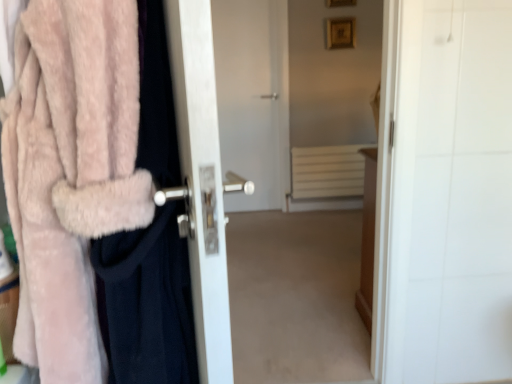
What is the approximate height of white matte radiator at center?

white matte radiator at center is 18.52 inches tall.

Locate an element on the screen. The image size is (512, 384). fuzzy pink coat at left is located at coordinates (147, 302).

Identify the location of white matte radiator at center. Image resolution: width=512 pixels, height=384 pixels. (328, 171).

Is fuzzy pink coat at left to the right of white matte radiator at center from the viewer's perspective?

No.

Are fuzzy pink coat at left and white matte radiator at center far apart?

Absolutely, fuzzy pink coat at left is distant from white matte radiator at center.

Is point (112, 133) farther from camera compared to point (345, 170)?

No, it is in front of (345, 170).

Looking at the image, does fuzzy pink coat at left seem bigger or smaller compared to white matte radiator at center?

Clearly, fuzzy pink coat at left is larger in size than white matte radiator at center.

Is fuzzy pink coat at left inside white glossy door handle at left?

No.

From the image's perspective, is white glossy door handle at left above fuzzy pink coat at left?

No, from the image's perspective, white glossy door handle at left is not above fuzzy pink coat at left.

Based on the photo, does white glossy door handle at left come behind fuzzy pink coat at left?

Yes, the depth of white glossy door handle at left is greater than that of fuzzy pink coat at left.

Which of these two, white matte radiator at center or fuzzy pink coat at left, is wider?

fuzzy pink coat at left.

Is white matte radiator at center positioned with its back to fuzzy pink coat at left?

white matte radiator at center is not turned away from fuzzy pink coat at left.

From the image's perspective, which one is positioned lower, white matte radiator at center or fuzzy pink coat at left?

fuzzy pink coat at left, from the image's perspective.

Could you tell me if white matte radiator at center is facing white glossy door handle at left?

Yes, white matte radiator at center faces towards white glossy door handle at left.

From the picture: Is white matte radiator at center directly adjacent to white glossy door handle at left?

There is a gap between white matte radiator at center and white glossy door handle at left.

At what (x,y) coordinates should I click in order to perform the action: click on radiator beneath the white glossy door handle at left (from a real-world perspective). Please return your answer as a coordinate pair (x, y). Looking at the image, I should click on coord(328,171).

Is point (325, 148) less distant than point (213, 267)?

No.

Based on the photo, looking at their sizes, would you say fuzzy pink coat at left is wider or thinner than fuzzy pink coat at left?

In the image, fuzzy pink coat at left appears to be wider than fuzzy pink coat at left.

Is fuzzy pink coat at left facing away from fuzzy pink coat at left?

Absolutely, fuzzy pink coat at left is directed away from fuzzy pink coat at left.

Does fuzzy pink coat at left appear on the left side of fuzzy pink coat at left?

Yes, fuzzy pink coat at left is to the left of fuzzy pink coat at left.

Based on the photo, is fuzzy pink coat at left not within fuzzy pink coat at left?

No, fuzzy pink coat at left is not outside of fuzzy pink coat at left.

From a real-world perspective, is white matte radiator at center beneath fuzzy pink coat at left?

Yes, from a real-world perspective, white matte radiator at center is beneath fuzzy pink coat at left.

Which is further, (318, 180) or (109, 44)?

Point (318, 180)

Is white matte radiator at center not close to fuzzy pink coat at left?

Yes, white matte radiator at center and fuzzy pink coat at left are quite far apart.

Is fuzzy pink coat at left wider or thinner than fuzzy pink coat at left?

fuzzy pink coat at left is thinner than fuzzy pink coat at left.

Between fuzzy pink coat at left and fuzzy pink coat at left, which one appears on the right side from the viewer's perspective?

Positioned to the right is fuzzy pink coat at left.

Is fuzzy pink coat at left oriented towards fuzzy pink coat at left?

Yes, fuzzy pink coat at left is turned towards fuzzy pink coat at left.

Between point (123, 324) and point (102, 187), which one is positioned in front?

The point (102, 187) is closer.

You are a GUI agent. You are given a task and a screenshot of the screen. Output one action in this format:
    pyautogui.click(x=<x>, y=<y>)
    Task: Click on the radiator below the fuzzy pink coat at left (from a real-world perspective)
    The width and height of the screenshot is (512, 384).
    Given the screenshot: What is the action you would take?
    pyautogui.click(x=328, y=171)

You are a GUI agent. You are given a task and a screenshot of the screen. Output one action in this format:
    pyautogui.click(x=<x>, y=<y>)
    Task: Click on the towel that appears in front of the white glossy door handle at left
    The width and height of the screenshot is (512, 384).
    Given the screenshot: What is the action you would take?
    pyautogui.click(x=70, y=172)

Considering their positions, is white matte radiator at center positioned further to fuzzy pink coat at left than white glossy door handle at left?

Based on the image, white matte radiator at center appears to be further to fuzzy pink coat at left.

When comparing their distances from fuzzy pink coat at left, does white glossy door handle at left or white matte radiator at center seem closer?

white glossy door handle at left.

Looking at the image, which one is located further to fuzzy pink coat at left, white matte radiator at center or fuzzy pink coat at left?

Among the two, white matte radiator at center is located further to fuzzy pink coat at left.

Looking at this image, based on their spatial positions, is white glossy door handle at left or fuzzy pink coat at left closer to white matte radiator at center?

fuzzy pink coat at left.

Based on their spatial positions, is fuzzy pink coat at left or white matte radiator at center further from fuzzy pink coat at left?

white matte radiator at center is further to fuzzy pink coat at left.

Looking at the image, which one is located further to white matte radiator at center, fuzzy pink coat at left or white glossy door handle at left?

white glossy door handle at left.

Which object lies nearer to the anchor point fuzzy pink coat at left, fuzzy pink coat at left or white matte radiator at center?

fuzzy pink coat at left is positioned closer to the anchor fuzzy pink coat at left.

From the picture: Looking at the image, which one is located further to fuzzy pink coat at left, fuzzy pink coat at left or white glossy door handle at left?

fuzzy pink coat at left is positioned further to the anchor fuzzy pink coat at left.

The height and width of the screenshot is (384, 512). In order to click on clothing between white glossy door handle at left and white matte radiator at center from front to back in this screenshot , I will do `click(147, 302)`.

Locate an element on the screen. clothing between fuzzy pink coat at left and white matte radiator at center from front to back is located at coordinates click(147, 302).

Locate an element on the screen. clothing between fuzzy pink coat at left and white glossy door handle at left is located at coordinates (147, 302).

Identify the location of screen door between fuzzy pink coat at left and white matte radiator at center along the z-axis. This screenshot has width=512, height=384. (202, 181).